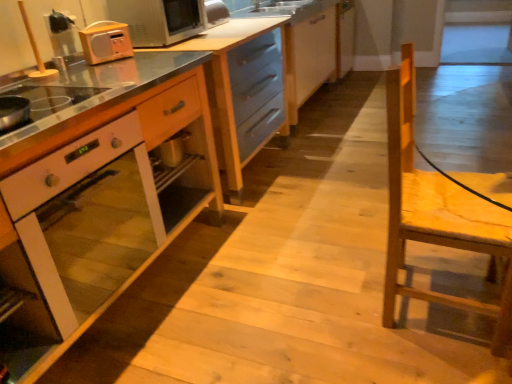
Question: Considering the relative positions of metallic silver microwave at upper left and wooden cabinet at center, which is the second cabinetry in right-to-left order, in the image provided, is metallic silver microwave at upper left to the left of wooden cabinet at center, which is the second cabinetry in right-to-left order, from the viewer's perspective?

Choices:
 (A) no
 (B) yes

Answer: (B)

Question: From the image's perspective, is metallic silver microwave at upper left on top of wooden cabinet at center, which is the second cabinetry in right-to-left order?

Choices:
 (A) no
 (B) yes

Answer: (B)

Question: Does metallic silver microwave at upper left have a larger size compared to wooden cabinet at center, which is the second cabinetry in right-to-left order?

Choices:
 (A) no
 (B) yes

Answer: (A)

Question: Is metallic silver microwave at upper left closer to camera compared to wooden cabinet at center, which is the second cabinetry in right-to-left order?

Choices:
 (A) no
 (B) yes

Answer: (A)

Question: Is wooden cabinet at center, which is the second cabinetry in right-to-left order, at the back of metallic silver microwave at upper left?

Choices:
 (A) yes
 (B) no

Answer: (B)

Question: Is white glossy oven at center taller or shorter than metallic silver microwave at upper left?

Choices:
 (A) short
 (B) tall

Answer: (B)

Question: In terms of width, does white glossy oven at center look wider or thinner when compared to metallic silver microwave at upper left?

Choices:
 (A) thin
 (B) wide

Answer: (B)

Question: In terms of size, does white glossy oven at center appear bigger or smaller than metallic silver microwave at upper left?

Choices:
 (A) small
 (B) big

Answer: (B)

Question: Is point (53, 175) positioned closer to the camera than point (134, 23)?

Choices:
 (A) farther
 (B) closer

Answer: (B)

Question: Does point (170, 96) appear closer or farther from the camera than point (284, 8)?

Choices:
 (A) closer
 (B) farther

Answer: (A)

Question: Considering the positions of wooden cabinet at center, which is the second cabinetry from left to right, and matte blue cabinet at center, marked as the 3th cabinetry in a right-to-left arrangement, in the image, is wooden cabinet at center, which is the second cabinetry from left to right, wider or thinner than matte blue cabinet at center, marked as the 3th cabinetry in a right-to-left arrangement,?

Choices:
 (A) wide
 (B) thin

Answer: (A)

Question: From a real-world perspective, is wooden cabinet at center, which is the second cabinetry in right-to-left order, above or below matte blue cabinet at center, marked as the 3th cabinetry in a right-to-left arrangement?

Choices:
 (A) above
 (B) below

Answer: (B)

Question: Is wooden cabinet at center, which is the second cabinetry from left to right, in front of or behind matte blue cabinet at center, arranged as the first cabinetry when viewed from the left, in the image?

Choices:
 (A) front
 (B) behind

Answer: (A)

Question: Would you say wooden cabinet at center, arranged as the 1th cabinetry when viewed from the right, is to the left or to the right of matte blue cabinet at center, marked as the 3th cabinetry in a right-to-left arrangement, in the picture?

Choices:
 (A) left
 (B) right

Answer: (B)

Question: Would you say wooden cabinet at center, positioned as the 3th cabinetry in left-to-right order, is inside or outside matte blue cabinet at center, arranged as the first cabinetry when viewed from the left?

Choices:
 (A) inside
 (B) outside

Answer: (B)